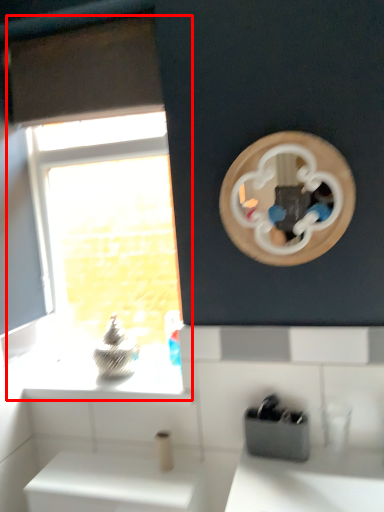
Question: Where is window (annotated by the red box) located in relation to appliance in the image?

Choices:
 (A) right
 (B) left

Answer: (B)